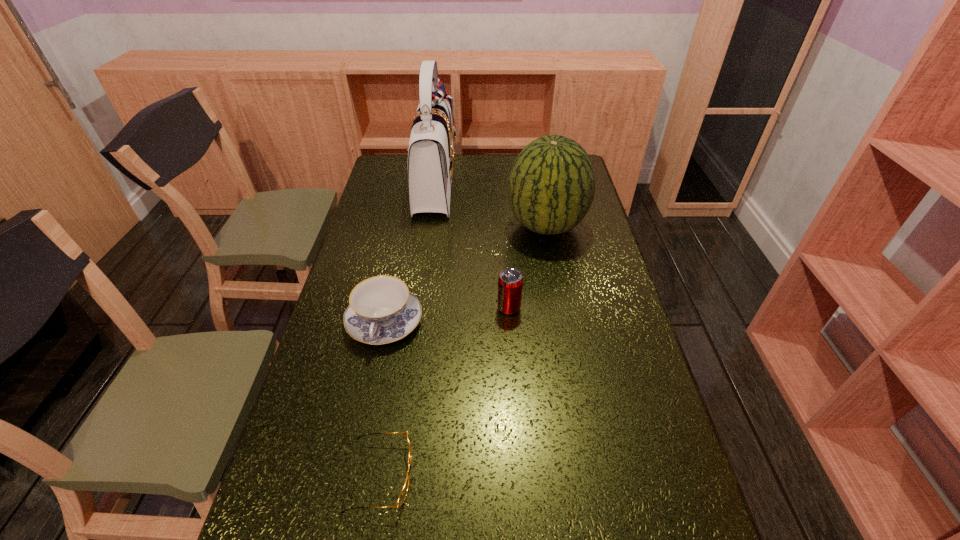
Identify the location of unoccupied area between the soda can and the watermelon. The width and height of the screenshot is (960, 540). (528, 267).

Find the location of `free space between the third tallest object and the watermelon`. free space between the third tallest object and the watermelon is located at coordinates (528, 267).

Where is `vacant space that is in between the tallest object and the fourth shortest object`? The width and height of the screenshot is (960, 540). vacant space that is in between the tallest object and the fourth shortest object is located at coordinates (491, 205).

Locate an element on the screen. free space between the watermelon and the soda can is located at coordinates (528, 267).

Locate an element on the screen. This screenshot has height=540, width=960. free spot between the satchel and the watermelon is located at coordinates (491, 205).

Identify the location of blank region between the third tallest object and the fourth shortest object. The image size is (960, 540). (528, 267).

At what (x,y) coordinates should I click in order to perform the action: click on free space between the satchel and the third shortest object. Please return your answer as a coordinate pair (x, y). The height and width of the screenshot is (540, 960). Looking at the image, I should click on (471, 247).

Identify the location of vacant area that lies between the tallest object and the watermelon. Image resolution: width=960 pixels, height=540 pixels. (491, 205).

Find the location of a particular element. The width and height of the screenshot is (960, 540). free space between the soda can and the chinaware is located at coordinates (446, 315).

Identify which object is the third nearest to the watermelon. Please provide its 2D coordinates. Your answer should be formatted as a tuple, i.e. [(x, y)], where the tuple contains the x and y coordinates of a point satisfying the conditions above.

[(382, 310)]